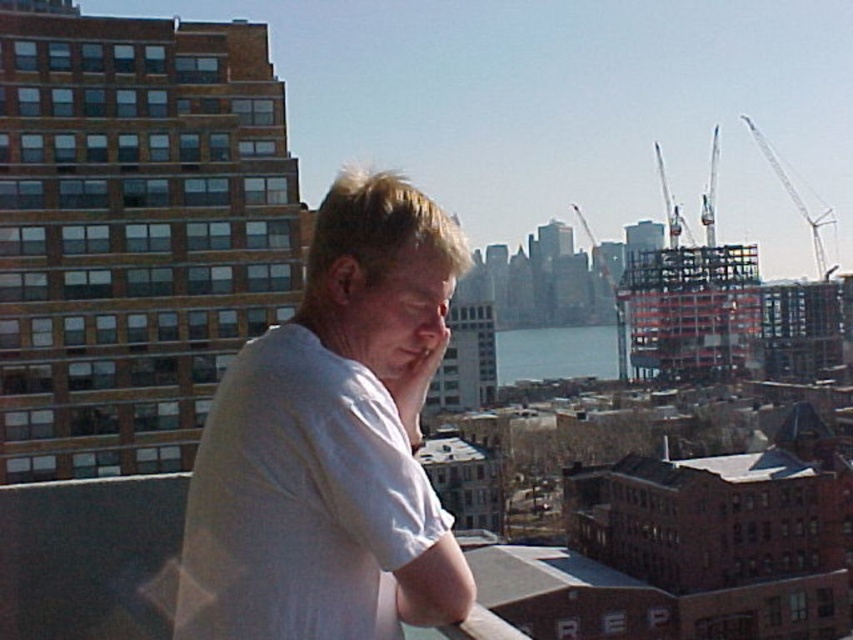
Question: Does white cotton shirt at center have a lesser width compared to white metallic crane at upper right?

Choices:
 (A) yes
 (B) no

Answer: (A)

Question: Is white cotton shirt at center below white metallic crane at upper right?

Choices:
 (A) yes
 (B) no

Answer: (A)

Question: Which of the following is the farthest from the observer?

Choices:
 (A) (228, 561)
 (B) (758, 138)

Answer: (B)

Question: Is white cotton shirt at center closer to camera compared to white metallic crane at upper right?

Choices:
 (A) yes
 (B) no

Answer: (A)